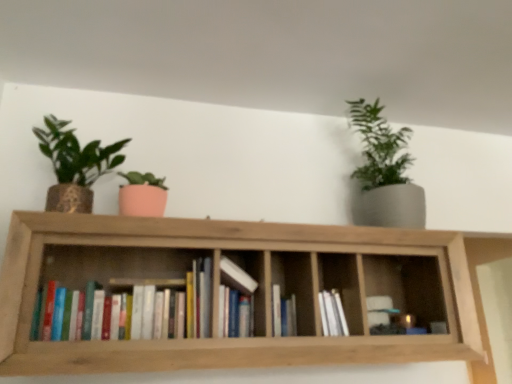
Question: Is hardcover book at center, the third book viewed from the left, far from wooden bookshelf at center?

Choices:
 (A) yes
 (B) no

Answer: (B)

Question: Is hardcover book at center, the third book viewed from the left, oriented towards wooden bookshelf at center?

Choices:
 (A) yes
 (B) no

Answer: (A)

Question: From the image's perspective, does hardcover book at center, the third book viewed from the left, appear higher than wooden bookshelf at center?

Choices:
 (A) yes
 (B) no

Answer: (B)

Question: Is hardcover book at center, which is the first book from right to left, placed right next to wooden bookshelf at center?

Choices:
 (A) yes
 (B) no

Answer: (B)

Question: Can you confirm if hardcover book at center, which is the first book from right to left, is wider than wooden bookshelf at center?

Choices:
 (A) yes
 (B) no

Answer: (B)

Question: Would you say wooden bookshelf at center is part of hardcover book at center, which is the first book from right to left,'s contents?

Choices:
 (A) no
 (B) yes

Answer: (A)

Question: Does wooden bookshelf at center have a larger size compared to hardcover book at center, which is the first book from right to left?

Choices:
 (A) yes
 (B) no

Answer: (A)

Question: Is wooden bookshelf at center directly adjacent to hardcover book at center, the third book viewed from the left?

Choices:
 (A) no
 (B) yes

Answer: (A)

Question: Considering the relative sizes of wooden bookshelf at center and hardcover book at center, which is the first book from right to left, in the image provided, is wooden bookshelf at center wider than hardcover book at center, which is the first book from right to left,?

Choices:
 (A) yes
 (B) no

Answer: (A)

Question: From the image's perspective, is wooden bookshelf at center located beneath hardcover book at center, which is the first book from right to left?

Choices:
 (A) no
 (B) yes

Answer: (A)

Question: Is the depth of wooden bookshelf at center less than that of hardcover book at center, the third book viewed from the left?

Choices:
 (A) yes
 (B) no

Answer: (A)

Question: Does wooden bookshelf at center have a smaller size compared to hardcover book at center, the third book viewed from the left?

Choices:
 (A) no
 (B) yes

Answer: (A)

Question: Is the depth of hardcover books at center, which appears as the 1th book when viewed from the left, less than that of matte gold pot at left, which is the 1th houseplant from left to right?

Choices:
 (A) yes
 (B) no

Answer: (A)